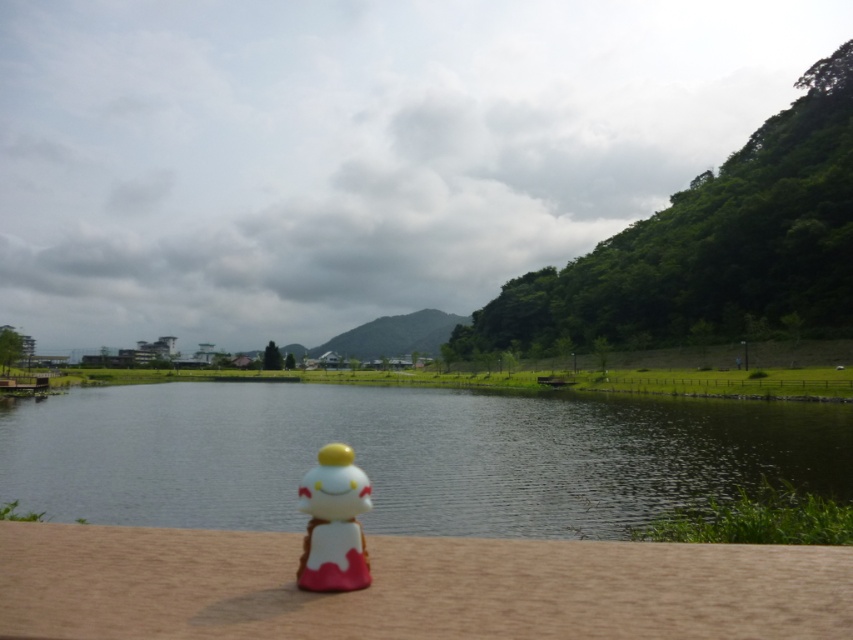
Is transparent water at lake center to the right of matte plastic figurine at center from the viewer's perspective?

No, transparent water at lake center is not to the right of matte plastic figurine at center.

The image size is (853, 640). What do you see at coordinates (407, 456) in the screenshot? I see `transparent water at lake center` at bounding box center [407, 456].

Is point (1, 472) behind point (349, 483)?

Yes, it is.

Find the location of a particular element. The height and width of the screenshot is (640, 853). transparent water at lake center is located at coordinates (407, 456).